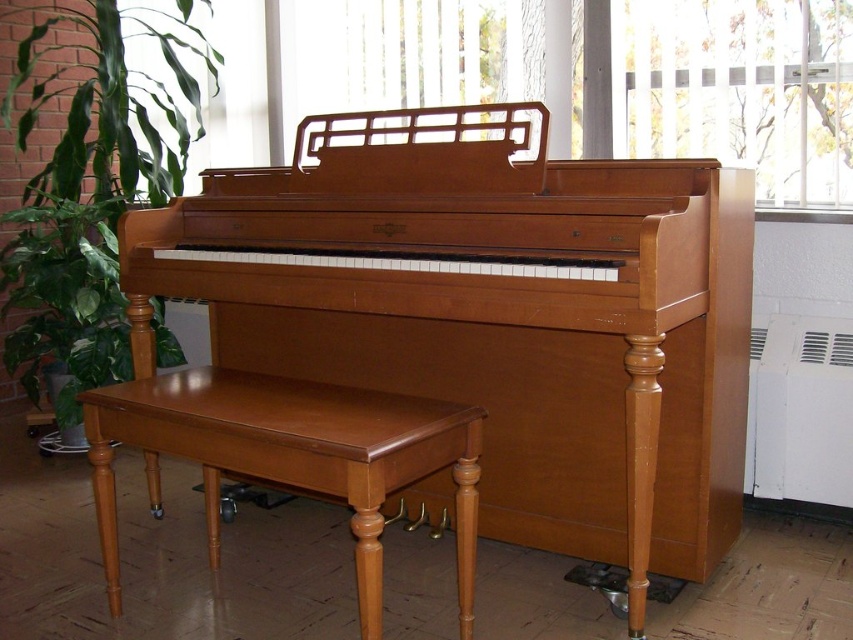
You are a guest in a living room with a vintage upright piano. You see a green leafy plant at left and a brown leather stool at lower left. If you want to place a large decorative item between them, will there be enough space?

The green leafy plant at left has a larger width than the brown leather stool at lower left, so there is sufficient space between them to place a large decorative item.